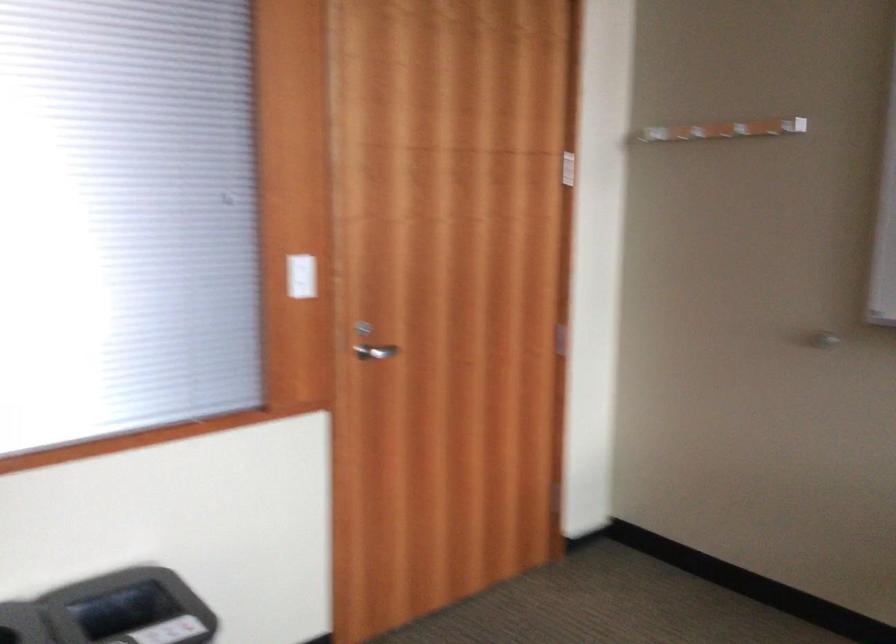
I want to click on silver door handle, so click(x=375, y=351).